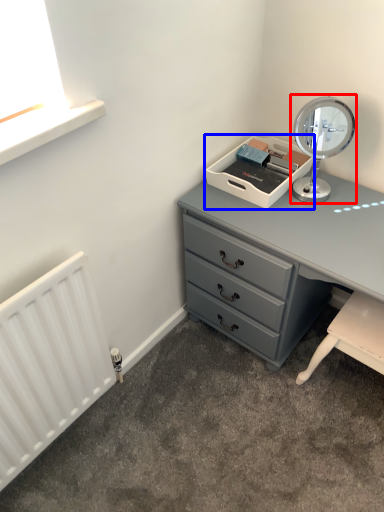
Question: Which of the following is the farthest to the observer, table lamp (highlighted by a red box) or printer (highlighted by a blue box)?

Choices:
 (A) table lamp
 (B) printer

Answer: (B)